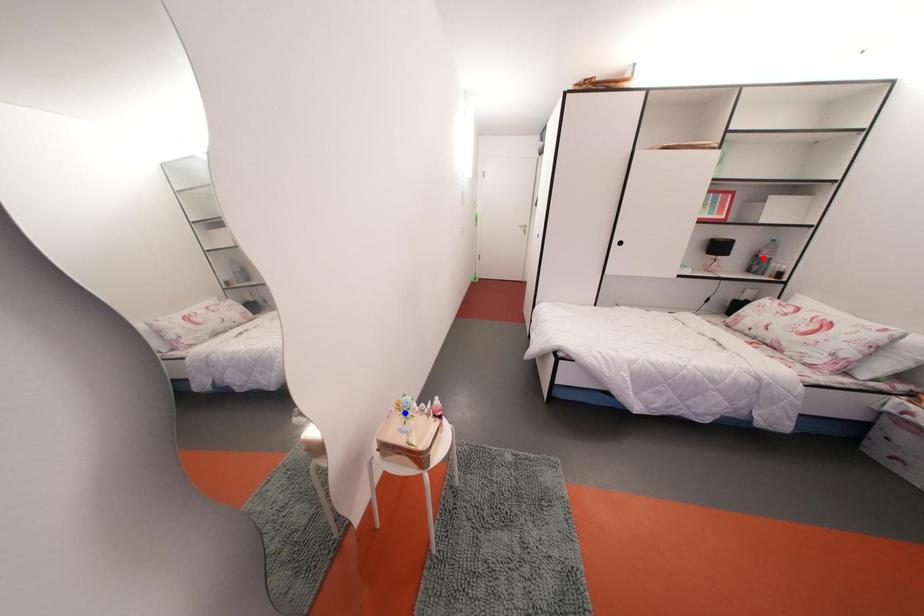
Question: Two points are marked on the image. Which point is closer to the camera?

Choices:
 (A) Blue point is closer.
 (B) Red point is closer.

Answer: (A)